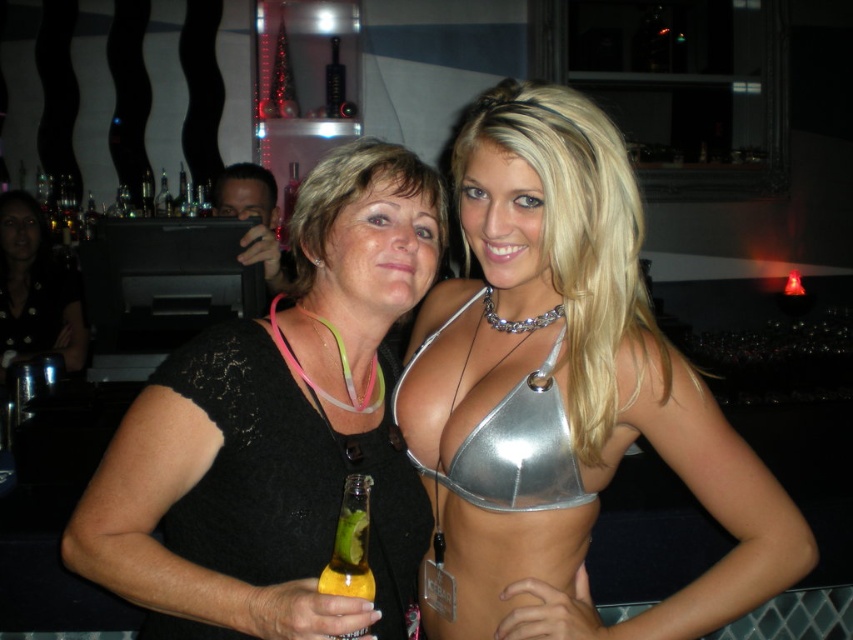
You are a fashion designer observing the two tops in the image. The metallic silver top at center and the black lace top at center. Which one is covering more of the upper body area?

The metallic silver top at center is positioned over the black lace top at center, indicating it covers more of the upper body area.

You are a bartender who needs to place a new order of drinks on the counter. The counter has limited space. You have the black fabric shirt at center and the translucent yellow glass bottle at lower left. Which item should you prioritize placing first to maximize space efficiency?

The translucent yellow glass bottle at lower left should be placed first since it is smaller than the black fabric shirt at center, allowing more space for other items.

Looking at this image, you are at a bar and want to grab the translucent yellow glass bottle at lower left without touching the black fabric shirt at center. Is there enough space between them?

The black fabric shirt at center is positioned on the left side of the translucent yellow glass bottle at lower left, so there is space between them. You can reach the translucent yellow glass bottle at lower left without touching the black fabric shirt at center.